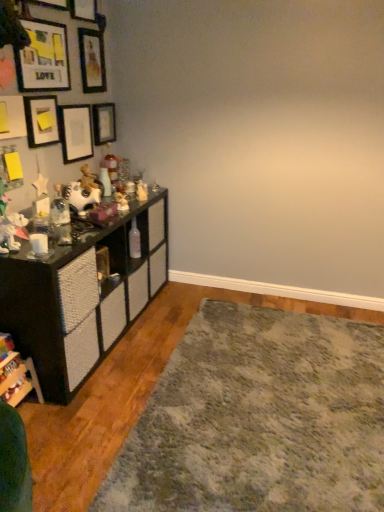
Question: Should I look upward or downward to see black textured cabinet at left, acting as the second shelf starting from the front?

Choices:
 (A) up
 (B) down

Answer: (B)

Question: Is black textured cabinet at left, acting as the second shelf starting from the front, turned away from shaggy gray rug at lower right?

Choices:
 (A) no
 (B) yes

Answer: (A)

Question: Does black textured cabinet at left, acting as the second shelf starting from the front, appear on the left side of shaggy gray rug at lower right?

Choices:
 (A) no
 (B) yes

Answer: (B)

Question: From the image's perspective, is black textured cabinet at left, acting as the second shelf starting from the front, above shaggy gray rug at lower right?

Choices:
 (A) yes
 (B) no

Answer: (A)

Question: From the image's perspective, would you say black textured cabinet at left, acting as the second shelf starting from the front, is shown under shaggy gray rug at lower right?

Choices:
 (A) yes
 (B) no

Answer: (B)

Question: Considering the relative positions of black textured cabinet at left, acting as the second shelf starting from the front, and shaggy gray rug at lower right in the image provided, is black textured cabinet at left, acting as the second shelf starting from the front, in front of shaggy gray rug at lower right?

Choices:
 (A) yes
 (B) no

Answer: (B)

Question: Is the surface of black textured cabinet at left, the 1th shelf in the back-to-front sequence, in direct contact with shaggy gray rug at lower right?

Choices:
 (A) yes
 (B) no

Answer: (B)

Question: From the image's perspective, does wooden picture frame at upper left, which is the sixth picture frame in bottom-to-top order, appear lower than matte black picture frame at upper left, marked as the 2th picture frame in a bottom-to-top arrangement?

Choices:
 (A) yes
 (B) no

Answer: (B)

Question: Is matte black picture frame at upper left, marked as the 2th picture frame in a bottom-to-top arrangement, a part of wooden picture frame at upper left, the 1th picture frame when ordered from top to bottom?

Choices:
 (A) yes
 (B) no

Answer: (B)

Question: Does wooden picture frame at upper left, the 1th picture frame when ordered from top to bottom, have a greater width compared to matte black picture frame at upper left, marked as the 2th picture frame in a bottom-to-top arrangement?

Choices:
 (A) yes
 (B) no

Answer: (A)

Question: Is wooden picture frame at upper left, the 1th picture frame when ordered from top to bottom, not within matte black picture frame at upper left, marked as the 2th picture frame in a bottom-to-top arrangement?

Choices:
 (A) no
 (B) yes

Answer: (B)

Question: Does wooden picture frame at upper left, the 1th picture frame when ordered from top to bottom, have a larger size compared to matte black picture frame at upper left, positioned as the fifth picture frame in top-to-bottom order?

Choices:
 (A) yes
 (B) no

Answer: (A)

Question: Can you confirm if wooden picture frame at upper left, which is the sixth picture frame in bottom-to-top order, is thinner than matte black picture frame at upper left, marked as the 2th picture frame in a bottom-to-top arrangement?

Choices:
 (A) no
 (B) yes

Answer: (A)

Question: Is matte black picture frame at upper left, marked as the 2th picture frame in a bottom-to-top arrangement, to the right of wooden picture frame at upper left, positioned as the 3th picture frame in top-to-bottom order, from the viewer's perspective?

Choices:
 (A) no
 (B) yes

Answer: (B)